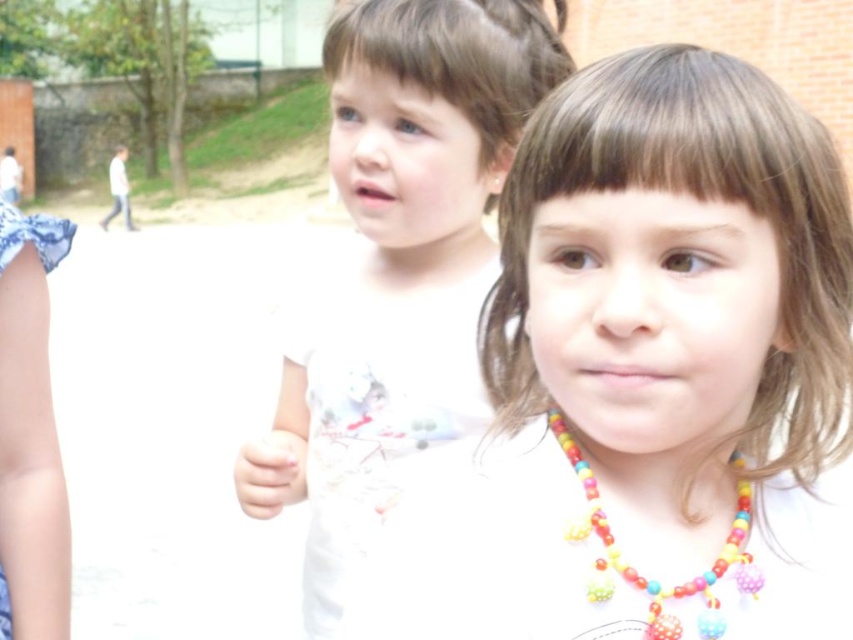
Question: Does multicolored beaded necklace at center lie in front of white matte hand at center?

Choices:
 (A) yes
 (B) no

Answer: (A)

Question: Among these points, which one is farthest from the camera?

Choices:
 (A) (647, 609)
 (B) (592, 134)
 (C) (322, 58)

Answer: (C)

Question: In this image, where is white matte necklace at center located relative to white matte hand at center?

Choices:
 (A) left
 (B) right

Answer: (B)

Question: Which of these objects is positioned closest to the multicolored beaded necklace at center?

Choices:
 (A) white matte shirt at center
 (B) white matte necklace at center

Answer: (B)

Question: Does white matte necklace at center appear on the left side of white matte hand at center?

Choices:
 (A) no
 (B) yes

Answer: (A)

Question: Which of the following is the closest to the observer?

Choices:
 (A) white matte hand at center
 (B) multicolored beaded necklace at center
 (C) white matte necklace at center
 (D) white matte shirt at center

Answer: (C)